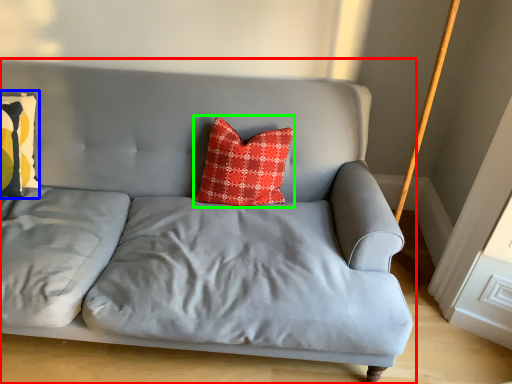
Question: Based on their relative distances, which object is nearer to studio couch (highlighted by a red box)? Choose from pillow (highlighted by a blue box) and pillow (highlighted by a green box).

Choices:
 (A) pillow
 (B) pillow

Answer: (B)